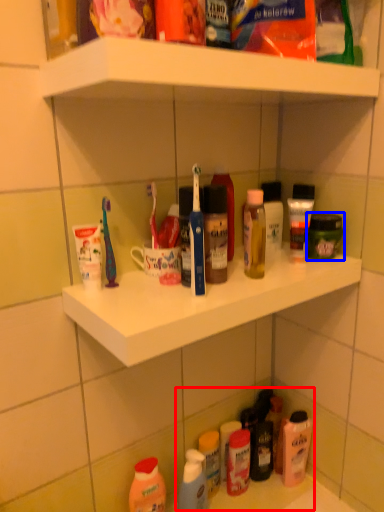
Question: Which object appears closest to the camera in this image, product (highlighted by a red box) or toiletry (highlighted by a blue box)?

Choices:
 (A) product
 (B) toiletry

Answer: (B)